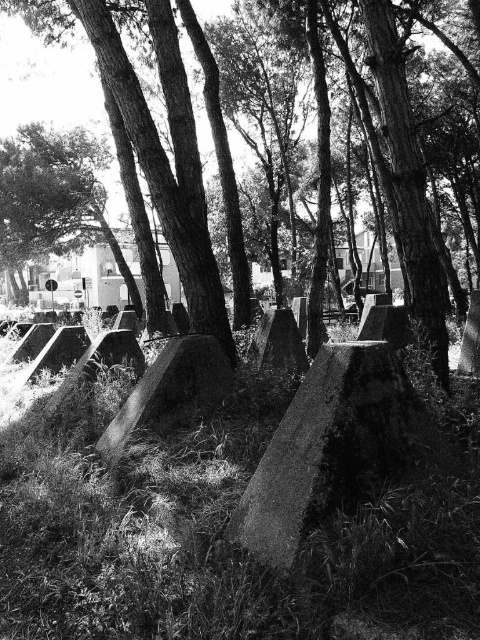
You are standing in the forest and see the smooth bark tree at center and the smooth stone boulder at center. Which object is located to the right of the other?

The smooth bark tree at center is positioned on the right side of smooth stone boulder at center, so the smooth bark tree at center is to the right of the smooth stone boulder at center.

You are a hiker carrying a backpack that is 1.2 meters wide. You want to walk between the smooth bark tree at center and the smooth stone boulder at center. Can you fit through the space between them?

The distance between the smooth bark tree at center and the smooth stone boulder at center is 1.31 meters. Since your backpack is 1.2 meters wide, you can fit through the space between them as the distance is slightly wider than your backpack.

You are a botanist examining a black and white photo of a forested area with concrete structures in the foreground. You notice a point labeled as point (x=407, y=177). What does this point represent?

The point (x=407, y=177) represents the location of the smooth bark tree at center.